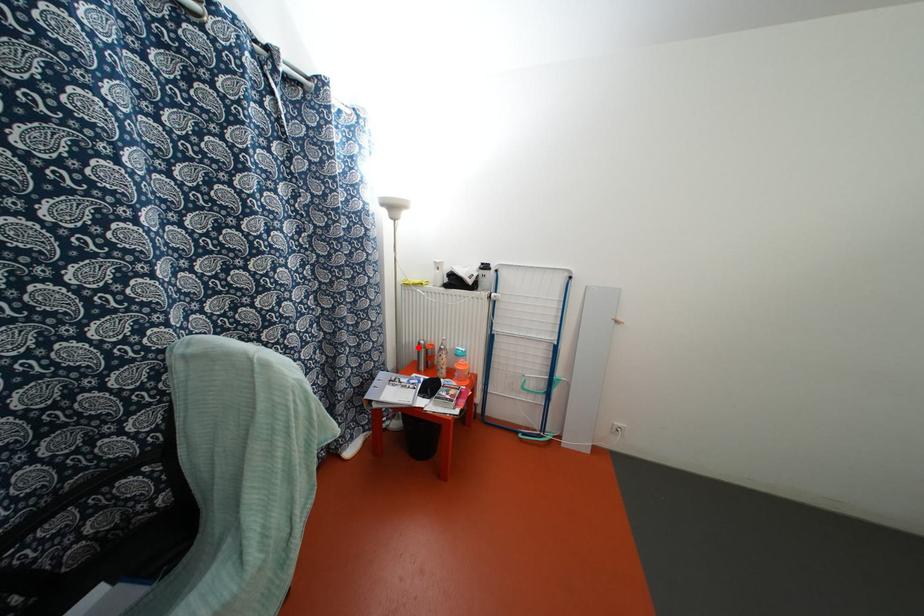
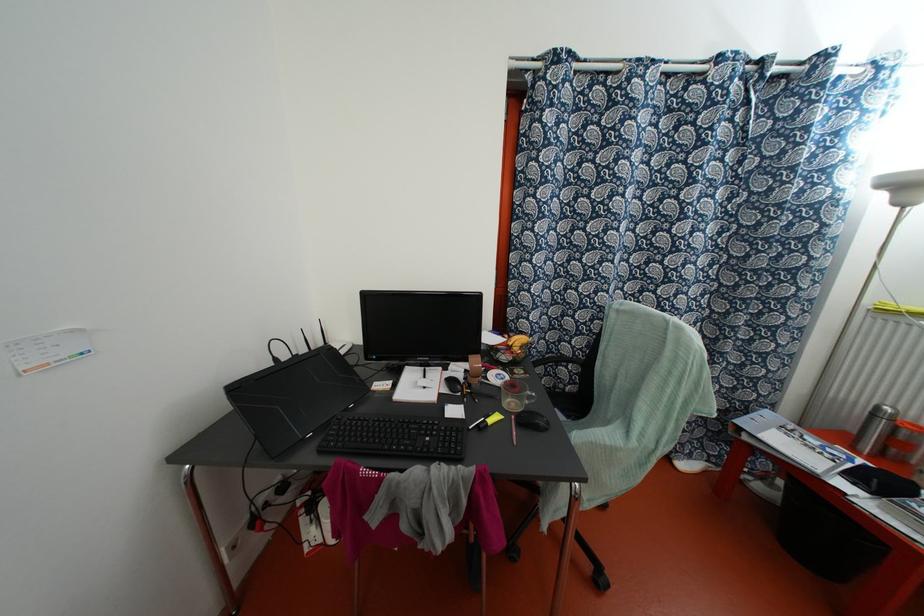
Locate, in the second image, the point that corresponds to the highlighted location in the first image.

(872, 415)